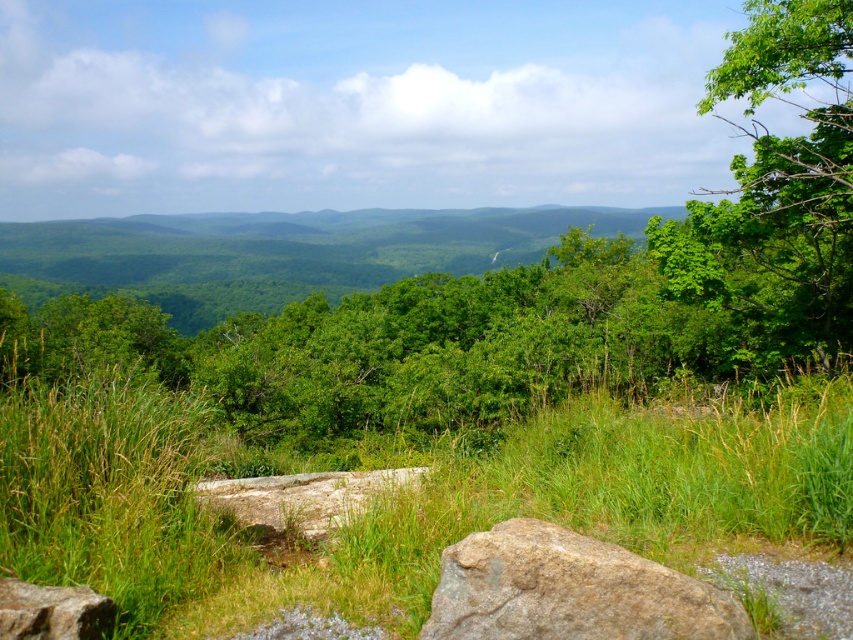
You are a hiker who wants to cross the area between the green grassy at center and the gray rock at center. Your backpack has a width of 2.5 feet. Can you pass through the space between them?

The distance between the green grassy at center and the gray rock at center is 4.31 feet. Since your backpack is 2.5 feet wide, there is enough space to pass through as 4.31 feet is greater than 2.5 feet.

You are an environmental scientist studying the landscape. You need to compare the sizes of the green leafy tree at upper right and the brown rough rock at lower center. Which one has a larger width?

The green leafy tree at upper right has a larger width than the brown rough rock at lower center according to the description.

You are standing at the center of the image and want to locate the green leafy tree at upper right. Based on the coordinates provided, in which direction should you look to find it?

The green leafy tree at upper right is located at point coordinates, so you should look towards the upper right direction to find it.